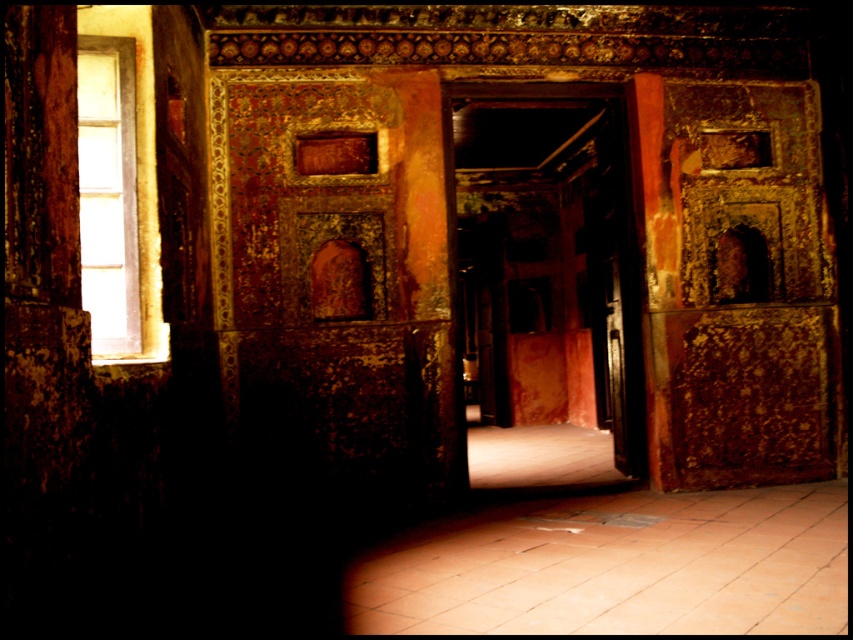
You are an interior designer planning to install a new decorative element. You have a choice between placing a wide tapestry on the clear glass window at left or the metallic polished door at center. Based on their sizes, which object would be more suitable for the tapestry?

The clear glass window at left is wider than the metallic polished door at center, so the tapestry would be more suitable for the clear glass window at left.

You are standing in the old building and want to exit through the nearest exit. You see a clear glass window at left and a metallic polished door at center. Which one is closer to you?

The clear glass window at left is closer to the viewer than the metallic polished door at center, so you should exit through the clear glass window at left.

You are standing in the room with the ornate walls and notice a point marked at coordinates (117, 196). Based on the scene description, can you determine which object this point is located on?

The point at coordinates (117, 196) is located on the clear glass window at left.